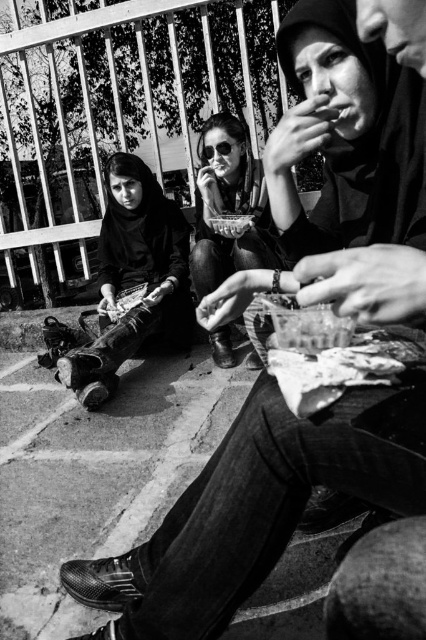
In the scene shown: You are a photographer trying to capture a candid shot of the two subjects in the scene. Since you want to focus on their faces, which object should you avoid blocking in your shot? Please choose between the matte black clothing at center and the sunglasses at center.

You should avoid blocking the sunglasses at center because the matte black clothing at center is located below it, so obscuring the sunglasses would cover the subjects face more directly.

Consider the image. You are a photographer adjusting your camera settings to focus on the two objects at the center of the scene. Which object should you adjust your focus to first if you want to capture both the matte black clothing at center and the sunglasses at center in sharp detail?

Since the matte black clothing at center is bigger than the sunglasses at center, you should focus on the matte black clothing at center first to ensure its larger details are sharp before adjusting for the smaller sunglasses at center.

You are a photographer trying to capture a candid shot of the matte black clothing at center and the sunglasses at center in the scene. If you want to ensure both are visible in the frame, which object should you position closer to the camera?

The sunglasses at center is behind matte black clothing at center, so to ensure both are visible, position the matte black clothing at center closer to the camera so it does not block the sunglasses at center behind it.